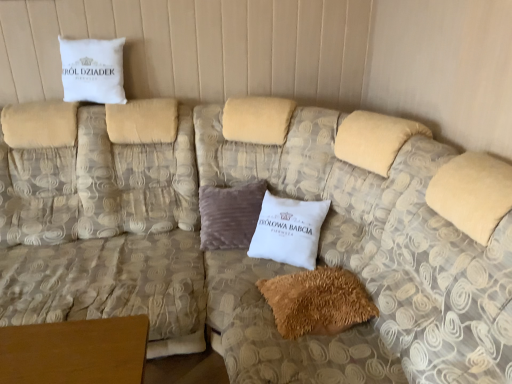
Question: Does white cotton pillow at upper left, which appears as the first pillow when viewed from the left, appear on the right side of beige fabric couch at upper left?

Choices:
 (A) no
 (B) yes

Answer: (B)

Question: From a real-world perspective, does white cotton pillow at upper left, which ranks as the second pillow in front-to-back order, stand above beige fabric couch at upper left?

Choices:
 (A) no
 (B) yes

Answer: (B)

Question: From the image's perspective, is white cotton pillow at upper left, the 1th pillow in the top-to-bottom sequence, over beige fabric couch at upper left?

Choices:
 (A) no
 (B) yes

Answer: (B)

Question: Is white cotton pillow at upper left, which ranks as the second pillow in front-to-back order, facing away from beige fabric couch at upper left?

Choices:
 (A) yes
 (B) no

Answer: (B)

Question: Considering the relative positions of white cotton pillow at upper left, positioned as the second pillow in bottom-to-top order, and beige fabric couch at upper left in the image provided, is white cotton pillow at upper left, positioned as the second pillow in bottom-to-top order, behind beige fabric couch at upper left?

Choices:
 (A) yes
 (B) no

Answer: (A)

Question: Considering the positions of brown fuzzy pillow at lower center, acting as the second pillow starting from the left, and beige fabric couch at upper left in the image, is brown fuzzy pillow at lower center, acting as the second pillow starting from the left, wider or thinner than beige fabric couch at upper left?

Choices:
 (A) wide
 (B) thin

Answer: (B)

Question: Is brown fuzzy pillow at lower center, which is the 1th pillow from front to back, in front of or behind beige fabric couch at upper left in the image?

Choices:
 (A) front
 (B) behind

Answer: (B)

Question: Considering the positions of brown fuzzy pillow at lower center, acting as the second pillow starting from the left, and beige fabric couch at upper left in the image, is brown fuzzy pillow at lower center, acting as the second pillow starting from the left, bigger or smaller than beige fabric couch at upper left?

Choices:
 (A) small
 (B) big

Answer: (A)

Question: From the image's perspective, relative to beige fabric couch at upper left, is brown fuzzy pillow at lower center, positioned as the first pillow in right-to-left order, above or below?

Choices:
 (A) below
 (B) above

Answer: (A)

Question: Considering the positions of white cotton pillow at upper left, the 1th pillow in the top-to-bottom sequence, and brown fuzzy pillow at lower center, which is the 1th pillow from front to back, in the image, is white cotton pillow at upper left, the 1th pillow in the top-to-bottom sequence, taller or shorter than brown fuzzy pillow at lower center, which is the 1th pillow from front to back,?

Choices:
 (A) tall
 (B) short

Answer: (A)

Question: From a real-world perspective, is white cotton pillow at upper left, positioned as the second pillow in bottom-to-top order, above or below brown fuzzy pillow at lower center, the second pillow when ordered from back to front?

Choices:
 (A) below
 (B) above

Answer: (B)

Question: In terms of width, does white cotton pillow at upper left, which is the second pillow in right-to-left order, look wider or thinner when compared to brown fuzzy pillow at lower center, which is the 1th pillow from front to back?

Choices:
 (A) wide
 (B) thin

Answer: (B)

Question: Considering the relative positions of white cotton pillow at upper left, which ranks as the second pillow in front-to-back order, and brown fuzzy pillow at lower center, which ranks as the 1th pillow in bottom-to-top order, in the image provided, is white cotton pillow at upper left, which ranks as the second pillow in front-to-back order, to the left or to the right of brown fuzzy pillow at lower center, which ranks as the 1th pillow in bottom-to-top order,?

Choices:
 (A) left
 (B) right

Answer: (A)

Question: Is brown fuzzy pillow at lower center, which is the 2th pillow from top to bottom, inside the boundaries of white cotton pillow at upper left, which appears as the first pillow when viewed from the left, or outside?

Choices:
 (A) outside
 (B) inside

Answer: (A)

Question: Is point (324, 309) closer or farther from the camera than point (95, 97)?

Choices:
 (A) closer
 (B) farther

Answer: (A)